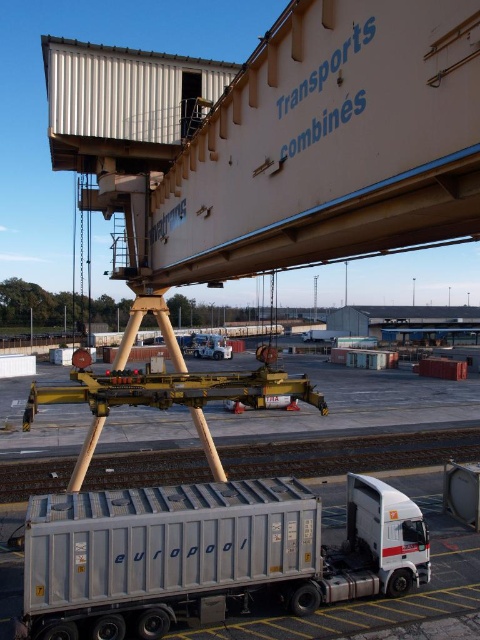
Question: From the image, what is the correct spatial relationship of metal train track at lower center in relation to metallic silver truck at center?

Choices:
 (A) above
 (B) below

Answer: (B)

Question: In this image, where is silver metallic trailer truck at lower center located relative to metallic silver truck at center?

Choices:
 (A) right
 (B) left

Answer: (A)

Question: Does silver metallic trailer truck at lower center appear over metal train track at lower center?

Choices:
 (A) no
 (B) yes

Answer: (B)

Question: Considering the real-world distances, which object is closest to the metal train track at lower center?

Choices:
 (A) silver metallic trailer truck at lower center
 (B) metallic silver truck at center

Answer: (A)

Question: Which object is closer to the camera taking this photo?

Choices:
 (A) metallic silver truck at center
 (B) silver metallic trailer truck at lower center
 (C) metal train track at lower center

Answer: (B)

Question: Which point appears farthest from the camera in this image?

Choices:
 (A) (135, 502)
 (B) (128, 470)
 (C) (212, 353)

Answer: (C)